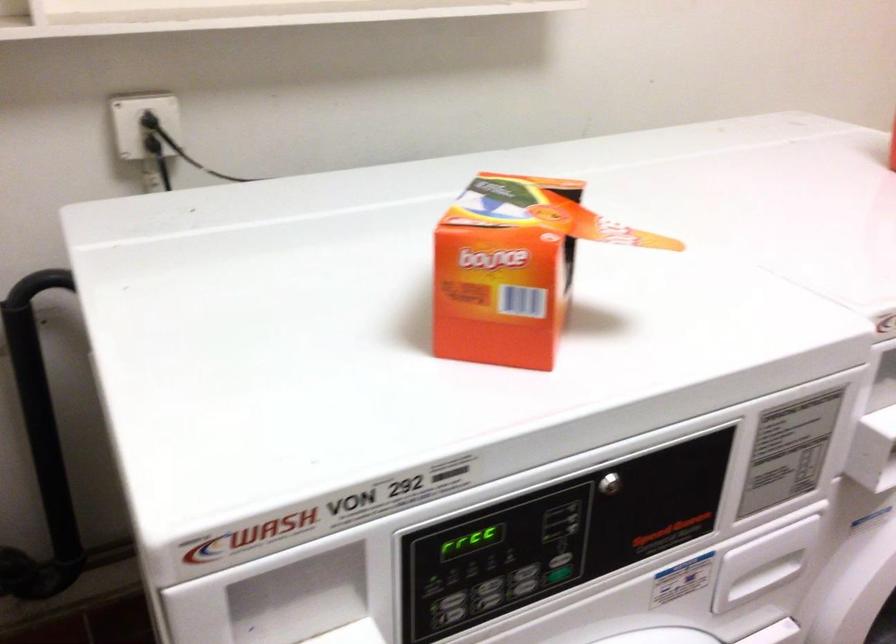
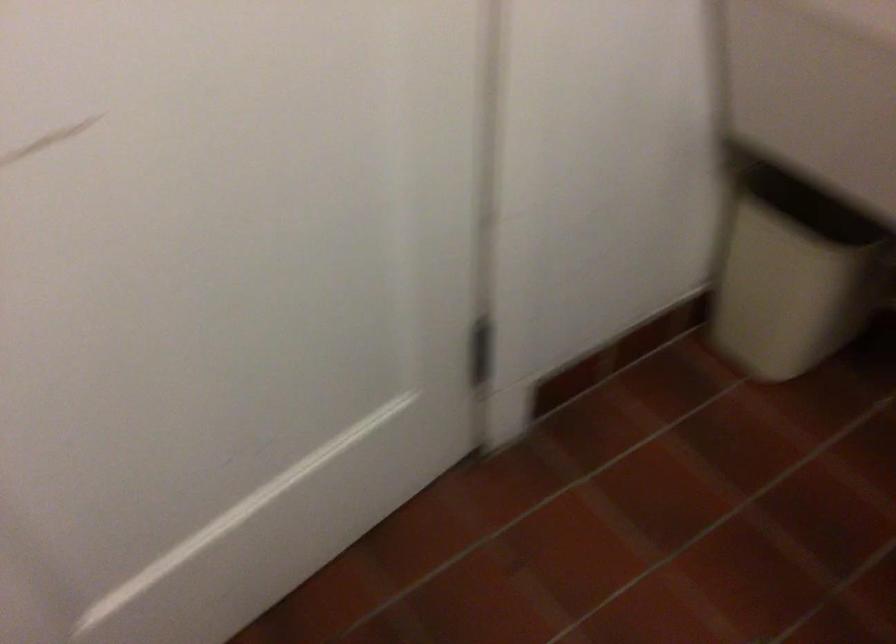
How did the camera likely rotate?

The camera rotated toward left-down.